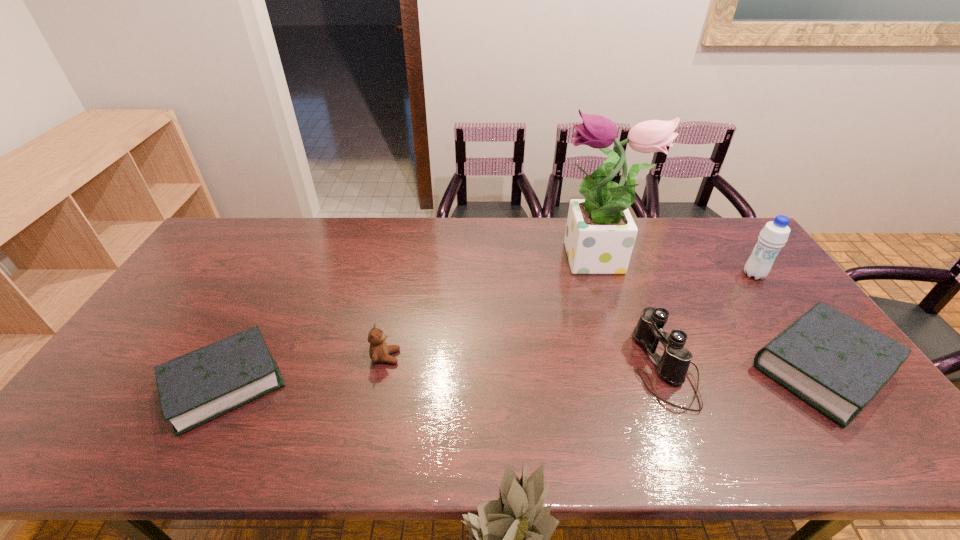
What are the coordinates of `vacant area that lies between the fifth tallest object and the teddy bear` in the screenshot? It's located at (604, 362).

At what (x,y) coordinates should I click in order to perform the action: click on free space between the binoculars and the fifth object from right to left. Please return your answer as a coordinate pair (x, y). Looking at the image, I should click on (525, 362).

Where is `empty space between the binoculars and the shortest object`? The height and width of the screenshot is (540, 960). empty space between the binoculars and the shortest object is located at coordinates (444, 376).

Find the location of `unoccupied position between the leftmost object and the third shortest object`. unoccupied position between the leftmost object and the third shortest object is located at coordinates (305, 370).

At what (x,y) coordinates should I click in order to perform the action: click on empty space between the binoculars and the water bottle. Please return your answer as a coordinate pair (x, y). The image size is (960, 540). Looking at the image, I should click on (708, 321).

The height and width of the screenshot is (540, 960). Identify the location of vacant space in between the binoculars and the shortest object. (444, 376).

Image resolution: width=960 pixels, height=540 pixels. I want to click on free spot between the right Bible and the binoculars, so click(743, 368).

The width and height of the screenshot is (960, 540). Identify the location of vacant space that is in between the third shortest object and the second shortest object. (604, 362).

Identify the location of empty space that is in between the fourth tallest object and the flower arrangement. Image resolution: width=960 pixels, height=540 pixels. (492, 309).

Where is `object that is the closest to the binoculars`? This screenshot has width=960, height=540. object that is the closest to the binoculars is located at coordinates (837, 364).